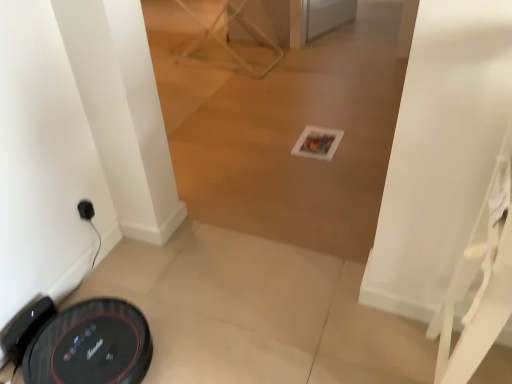
What do you see at coordinates (228, 42) in the screenshot? The image size is (512, 384). I see `white plastic folding table at upper center` at bounding box center [228, 42].

What are the coordinates of `white plastic folding table at upper center` in the screenshot? It's located at (228, 42).

At what (x,y) coordinates should I click in order to perform the action: click on white plastic folding table at upper center. Please return your answer as a coordinate pair (x, y). Looking at the image, I should click on (228, 42).